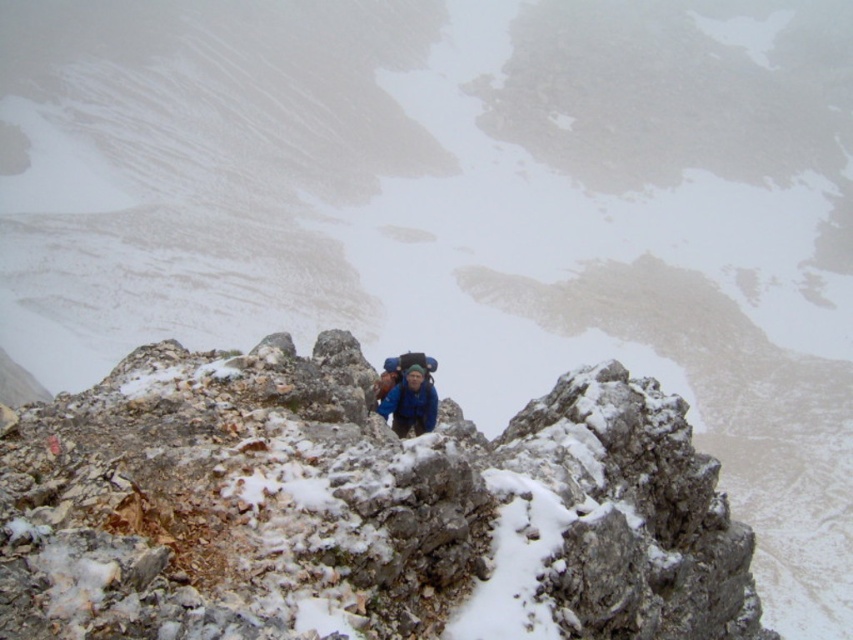
Question: Which point is closer to the camera taking this photo?

Choices:
 (A) (418, 369)
 (B) (273, 406)

Answer: (B)

Question: Which point is closer to the camera?

Choices:
 (A) (440, 458)
 (B) (404, 428)

Answer: (A)

Question: Can you confirm if gray rough rock at center is positioned to the left of blue fabric jacket at center?

Choices:
 (A) yes
 (B) no

Answer: (B)

Question: Is gray rough rock at center in front of blue fabric jacket at center?

Choices:
 (A) yes
 (B) no

Answer: (A)

Question: Observing the image, what is the correct spatial positioning of gray rough rock at center in reference to blue fabric jacket at center?

Choices:
 (A) below
 (B) above

Answer: (A)

Question: Which point appears closest to the camera in this image?

Choices:
 (A) (421, 410)
 (B) (585, 460)

Answer: (B)